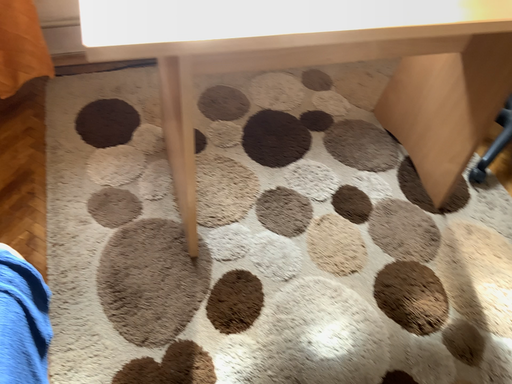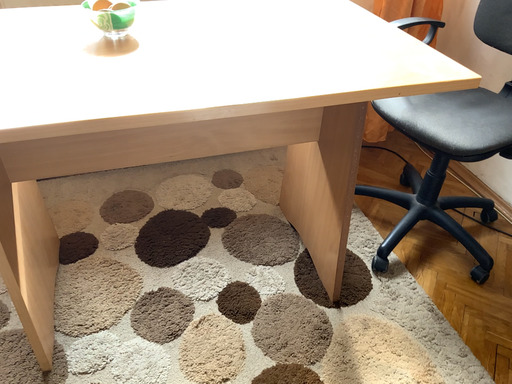
Question: How did the camera likely rotate when shooting the video?

Choices:
 (A) rotated upward
 (B) rotated downward

Answer: (A)